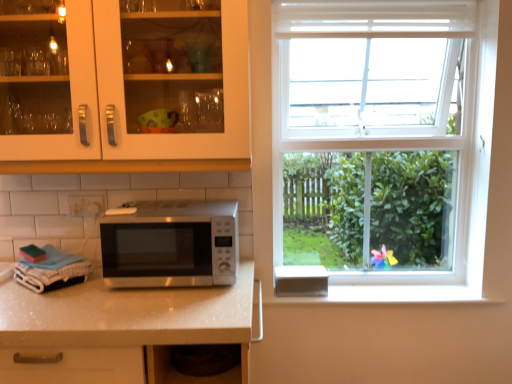
I want to click on satin silver microwave at center, so click(170, 244).

Based on the photo, in order to face satin silver microwave at center, should I rotate leftwards or rightwards?

To align with it, rotate left about 10.618°.

Image resolution: width=512 pixels, height=384 pixels. What do you see at coordinates (170, 244) in the screenshot?
I see `satin silver microwave at center` at bounding box center [170, 244].

What is the approximate height of satin silver microwave at center?

11.07 inches.

Describe the element at coordinates (125, 107) in the screenshot. I see `matte white cabinet at upper left` at that location.

Identify the location of matte white cabinet at upper left. (125, 107).

Locate an element on the screen. The height and width of the screenshot is (384, 512). satin silver microwave at center is located at coordinates (170, 244).

Does matte white cabinet at upper left appear on the left side of satin silver microwave at center?

Yes.

Is the depth of matte white cabinet at upper left less than that of satin silver microwave at center?

Yes, it is in front of satin silver microwave at center.

Does point (128, 136) lie in front of point (102, 219)?

No, it is behind (102, 219).

Looking at this image, from the image's perspective, is matte white cabinet at upper left positioned above or below satin silver microwave at center?

matte white cabinet at upper left is above satin silver microwave at center.

From a real-world perspective, relative to satin silver microwave at center, is matte white cabinet at upper left vertically above or below?

From a real-world perspective, matte white cabinet at upper left is physically above satin silver microwave at center.

Between matte white cabinet at upper left and satin silver microwave at center, which one has larger width?

With larger width is satin silver microwave at center.

Does matte white cabinet at upper left have a lesser height compared to satin silver microwave at center?

In fact, matte white cabinet at upper left may be taller than satin silver microwave at center.

Which of these two, matte white cabinet at upper left or satin silver microwave at center, is bigger?

matte white cabinet at upper left is bigger.

Is matte white cabinet at upper left positioned beyond the bounds of satin silver microwave at center?

Indeed, matte white cabinet at upper left is completely outside satin silver microwave at center.

Is there a large distance between matte white cabinet at upper left and satin silver microwave at center?

No.

Is satin silver microwave at center at the back of matte white cabinet at upper left?

That's not correct — matte white cabinet at upper left is not looking away from satin silver microwave at center.

How different are the orientations of matte white cabinet at upper left and satin silver microwave at center in degrees?

The angle between the facing direction of matte white cabinet at upper left and the facing direction of satin silver microwave at center is 0.00342 degrees.

In the image, there is a matte white cabinet at upper left. Where is `microwave oven below it (from a real-world perspective)`? microwave oven below it (from a real-world perspective) is located at coordinates (170, 244).

Between satin silver microwave at center and matte white cabinet at upper left, which one appears on the right side from the viewer's perspective?

satin silver microwave at center.

Is the depth of satin silver microwave at center less than that of matte white cabinet at upper left?

No, it is behind matte white cabinet at upper left.

Which point is more forward, [121,229] or [106,9]?

Positioned in front is point [106,9].

From the image's perspective, relative to matte white cabinet at upper left, is satin silver microwave at center above or below?

Based on their image positions, satin silver microwave at center is located beneath matte white cabinet at upper left.

From a real-world perspective, is satin silver microwave at center above or below matte white cabinet at upper left?

Clearly, from a real-world perspective, satin silver microwave at center is below matte white cabinet at upper left.

Considering the sizes of satin silver microwave at center and matte white cabinet at upper left in the image, is satin silver microwave at center wider or thinner than matte white cabinet at upper left?

Clearly, satin silver microwave at center has more width compared to matte white cabinet at upper left.

Does satin silver microwave at center have a lesser height compared to matte white cabinet at upper left?

Yes, satin silver microwave at center is shorter than matte white cabinet at upper left.

Based on the photo, is satin silver microwave at center bigger than matte white cabinet at upper left?

Incorrect, satin silver microwave at center is not larger than matte white cabinet at upper left.

Is satin silver microwave at center outside of matte white cabinet at upper left?

Yes, satin silver microwave at center is located beyond the bounds of matte white cabinet at upper left.

Are satin silver microwave at center and matte white cabinet at upper left beside each other?

No, satin silver microwave at center is not in contact with matte white cabinet at upper left.

Is satin silver microwave at center oriented towards matte white cabinet at upper left?

No.

Measure the distance from satin silver microwave at center to matte white cabinet at upper left.

satin silver microwave at center is 12.19 inches away from matte white cabinet at upper left.

You are a GUI agent. You are given a task and a screenshot of the screen. Output one action in this format:
    pyautogui.click(x=<x>, y=<y>)
    Task: Click on the cabinetry that appears on the left of satin silver microwave at center
    The image size is (512, 384).
    Given the screenshot: What is the action you would take?
    pyautogui.click(x=125, y=107)

The image size is (512, 384). What are the coordinates of `microwave oven that is behind the matte white cabinet at upper left` in the screenshot? It's located at (170, 244).

This screenshot has width=512, height=384. What are the coordinates of `cabinetry that appears on the left of satin silver microwave at center` in the screenshot? It's located at (125, 107).